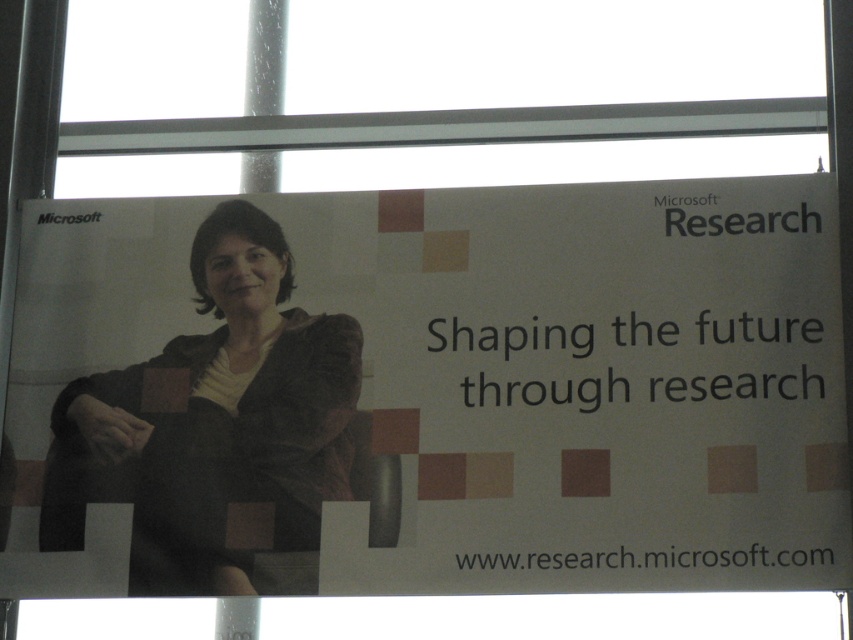
In the scene shown: Is white paper at center shorter than matte brown jacket at center?

No, white paper at center is not shorter than matte brown jacket at center.

Can you confirm if white paper at center is bigger than matte brown jacket at center?

Correct, white paper at center is larger in size than matte brown jacket at center.

Find the location of a particular element. The width and height of the screenshot is (853, 640). white paper at center is located at coordinates (430, 392).